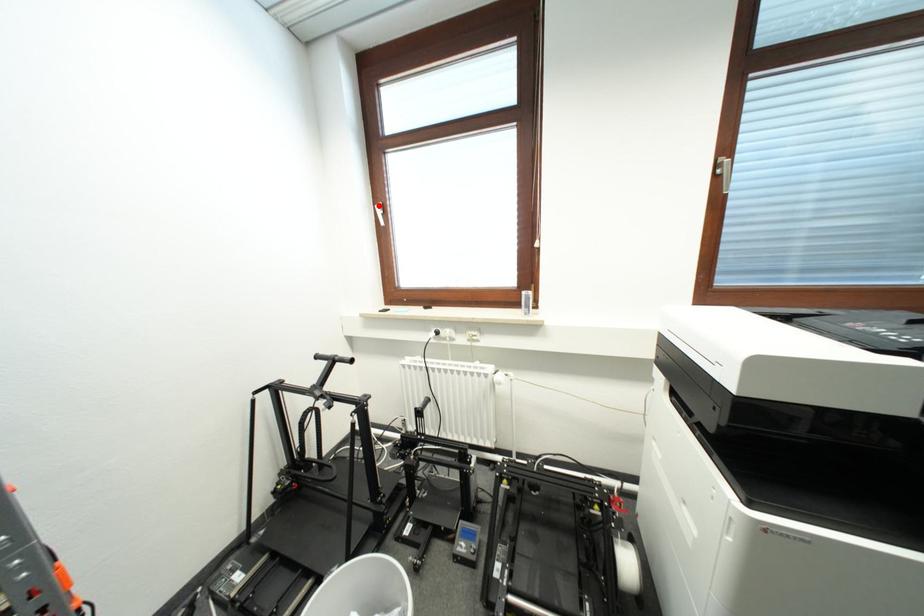
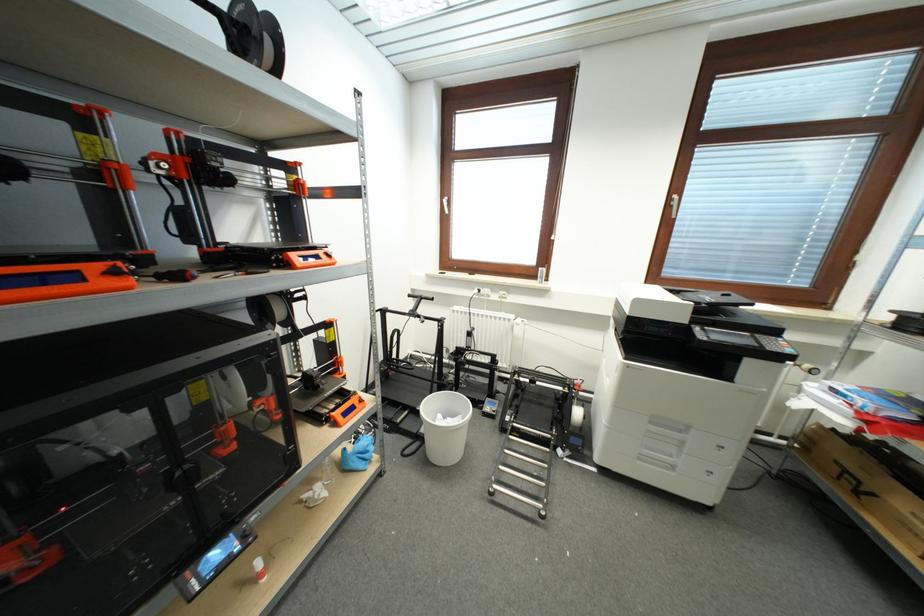
Find the pixel in the second image that matches the highlighted location in the first image.

(446, 200)